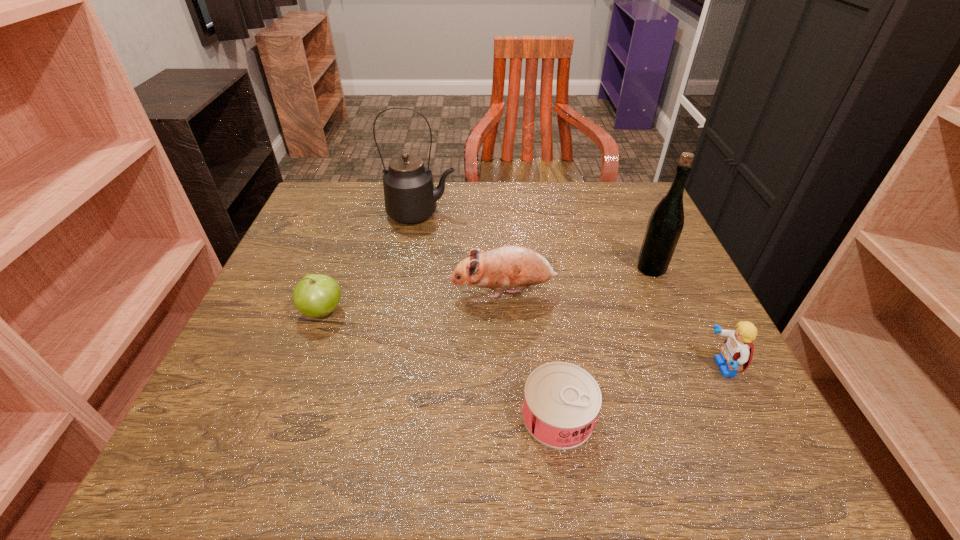
Point out which object is positioned as the second nearest to the hamster. Please provide its 2D coordinates. Your answer should be formatted as a tuple, i.e. [(x, y)], where the tuple contains the x and y coordinates of a point satisfying the conditions above.

[(666, 221)]

Identify the location of free space that satisfies the following two spatial constraints: 1. at the face of the hamster; 2. on the front side of the apple. (505, 312).

Where is `blank area in the image that satisfies the following two spatial constraints: 1. spout on the kettle; 2. on the back side of the beer bottle`? The image size is (960, 540). blank area in the image that satisfies the following two spatial constraints: 1. spout on the kettle; 2. on the back side of the beer bottle is located at coordinates pyautogui.click(x=413, y=268).

Find the location of a particular element. The image size is (960, 540). free location that satisfies the following two spatial constraints: 1. at the face of the hamster; 2. on the front side of the apple is located at coordinates (505, 312).

At what (x,y) coordinates should I click in order to perform the action: click on free spot that satisfies the following two spatial constraints: 1. on the front side of the beer bottle; 2. at the face of the hamster. Please return your answer as a coordinate pair (x, y). This screenshot has width=960, height=540. Looking at the image, I should click on (661, 291).

You are a GUI agent. You are given a task and a screenshot of the screen. Output one action in this format:
    pyautogui.click(x=<x>, y=<y>)
    Task: Click on the vacant region that satisfies the following two spatial constraints: 1. at the face of the nearest object; 2. on the right side of the hamster
    The width and height of the screenshot is (960, 540).
    Given the screenshot: What is the action you would take?
    pyautogui.click(x=511, y=415)

I want to click on free space that satisfies the following two spatial constraints: 1. at the face of the hamster; 2. on the right side of the nearest object, so click(511, 415).

Locate an element on the screen. The height and width of the screenshot is (540, 960). vacant space that satisfies the following two spatial constraints: 1. spout on the kettle; 2. on the right side of the beer bottle is located at coordinates (x=413, y=268).